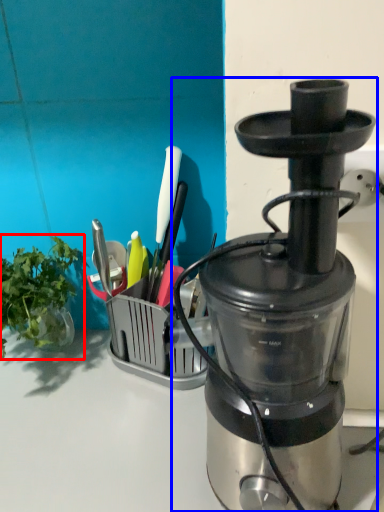
Question: Which of the following is the farthest to the observer, vegetable (highlighted by a red box) or blender (highlighted by a blue box)?

Choices:
 (A) vegetable
 (B) blender

Answer: (A)